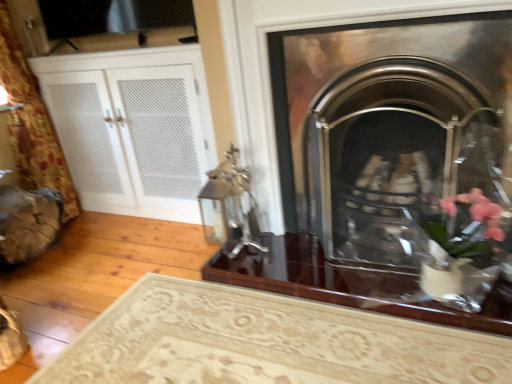
Where is `vacant area on top of glossy dark wood table at center (from a real-world perspective)`? vacant area on top of glossy dark wood table at center (from a real-world perspective) is located at coordinates (331, 256).